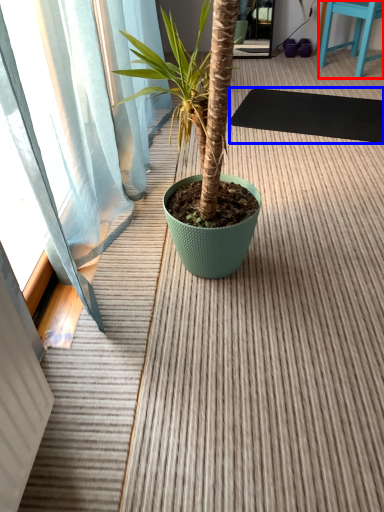
Question: Which point is closer to the camera, furniture (highlighted by a red box) or yoga mat (highlighted by a blue box)?

Choices:
 (A) furniture
 (B) yoga mat

Answer: (B)